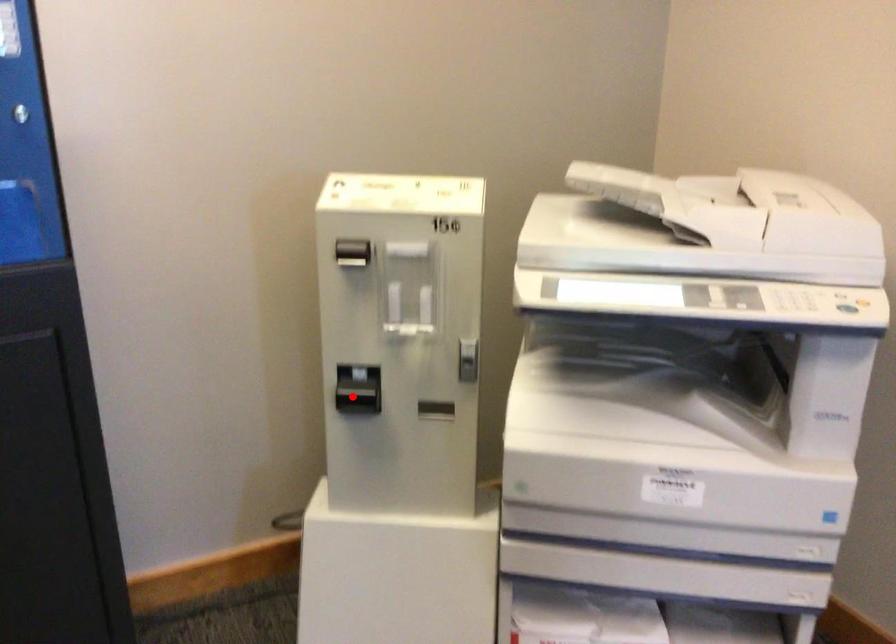
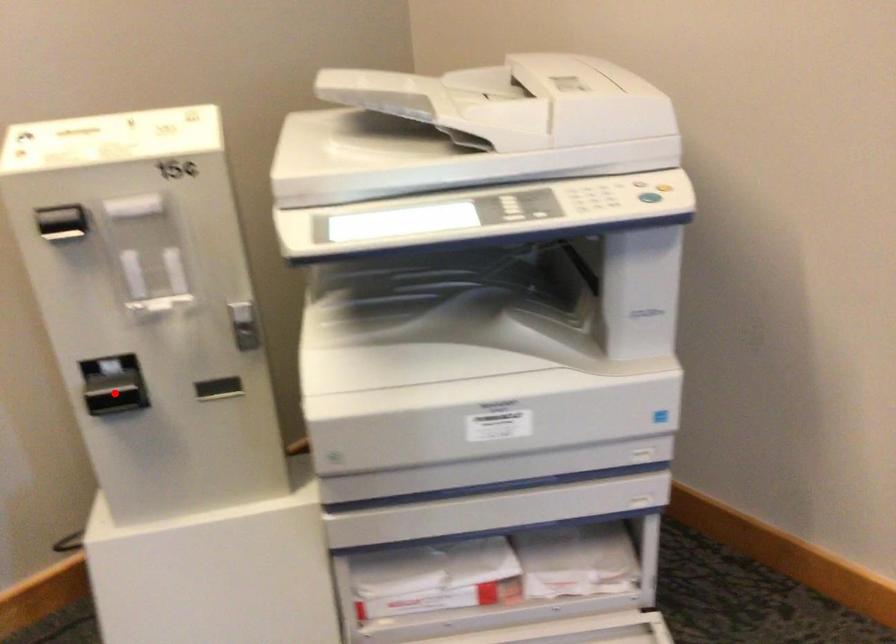
I am providing you with two images of the same scene from different viewpoints. A red point is marked on the first image and another point is marked on the second image. Are the points marked in image1 and image2 representing the same 3D position?

Yes